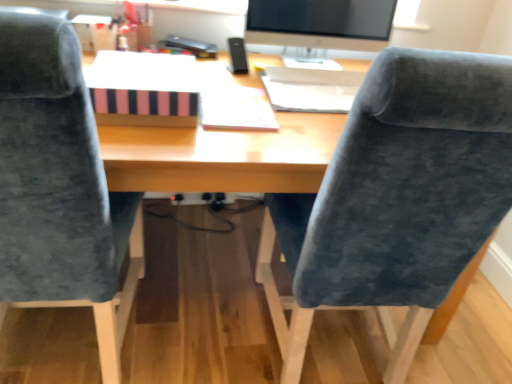
You are a GUI agent. You are given a task and a screenshot of the screen. Output one action in this format:
    pyautogui.click(x=<x>, y=<y>)
    Task: Click on the empty space that is ontop of white paper at center (from a real-world perspective)
    This screenshot has height=384, width=512.
    Given the screenshot: What is the action you would take?
    pyautogui.click(x=241, y=100)